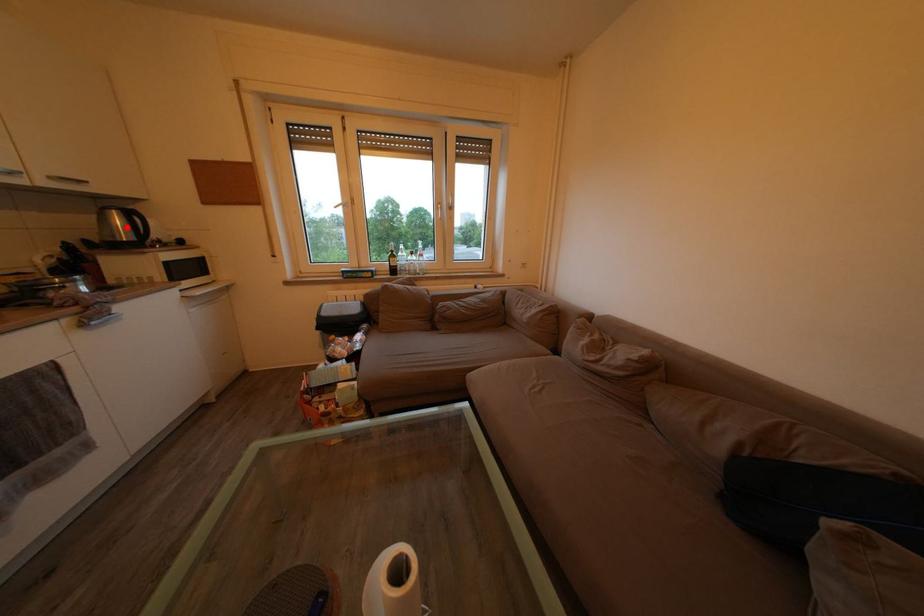
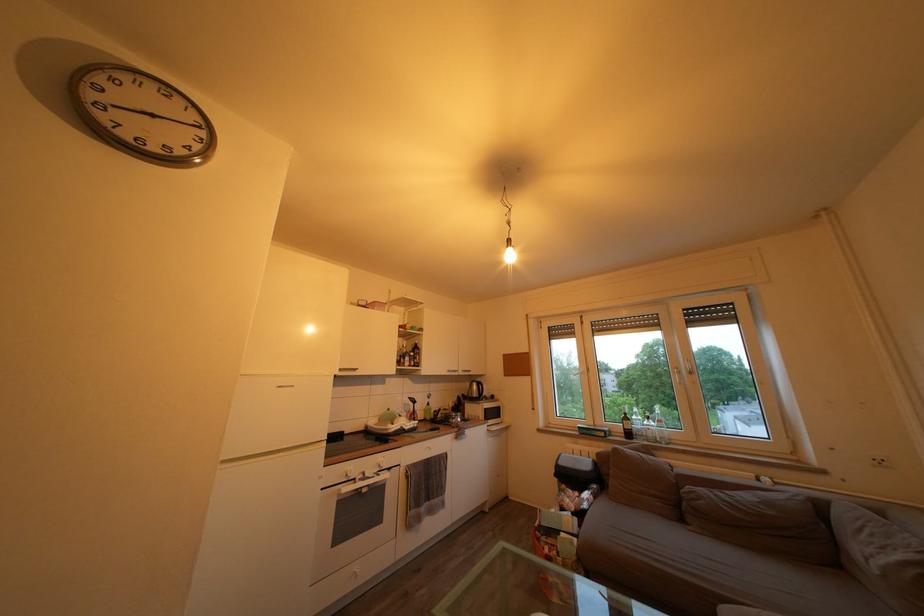
Find the pixel in the second image that matches the highlighted location in the first image.

(482, 392)